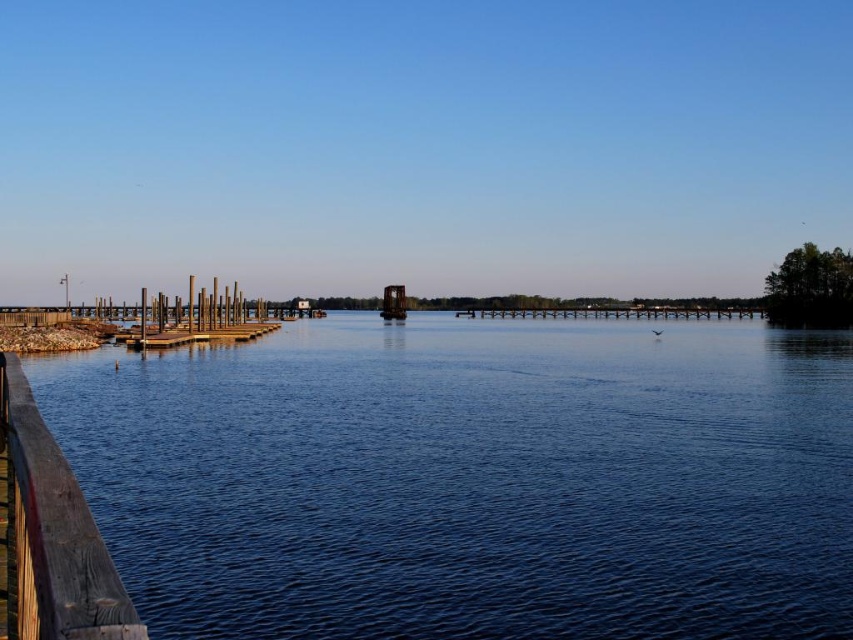
Does brown wooden rail at center have a greater height compared to rusty metal boat at center?

No, brown wooden rail at center is not taller than rusty metal boat at center.

Between brown wooden rail at center and rusty metal boat at center, which one has less height?

brown wooden rail at center

Is point (732, 307) in front of point (392, 307)?

No, it is not.

Identify the location of brown wooden rail at center. (614, 310).

The height and width of the screenshot is (640, 853). I want to click on wooden textured rail at lower left, so click(x=49, y=534).

Which is above, blue water at lower left or rusty metal boat at center?

rusty metal boat at center

Between point (326, 636) and point (398, 317), which one is positioned in front?

Point (326, 636) is more forward.

The height and width of the screenshot is (640, 853). Find the location of `blue water at lower left`. blue water at lower left is located at coordinates (473, 480).